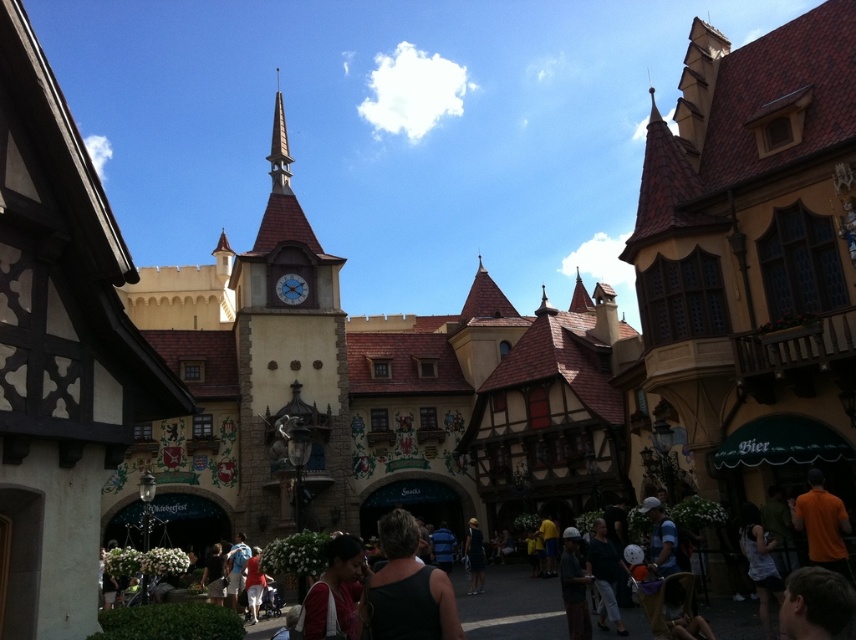
You are a tourist visiting the theme park and want to take a photo of the dark brown leather jacket at lower center without the matte stone clock tower at center blocking it. How should you position yourself to achieve this?

To take a photo of the dark brown leather jacket at lower center without the matte stone clock tower at center blocking it, move to a position behind the dark brown leather jacket at lower center so that the clock tower is no longer in front of it.

You are a photographer planning to take a photo of the two dresses at the theme park. Since both the matte pink dress at center and the black matte dress at center are in the center, which one is located to the left when viewed from your perspective?

The matte pink dress at center is positioned on the left side of the black matte dress at center, so when viewed from your perspective, the matte pink dress at center is to the left of the black matte dress at center.